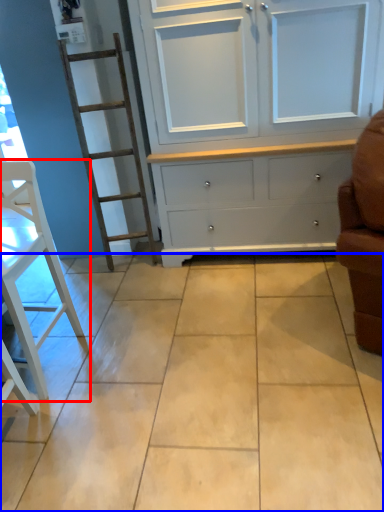
Question: Among these objects, which one is nearest to the camera, furniture (highlighted by a red box) or ceramic tile (highlighted by a blue box)?

Choices:
 (A) furniture
 (B) ceramic tile

Answer: (B)